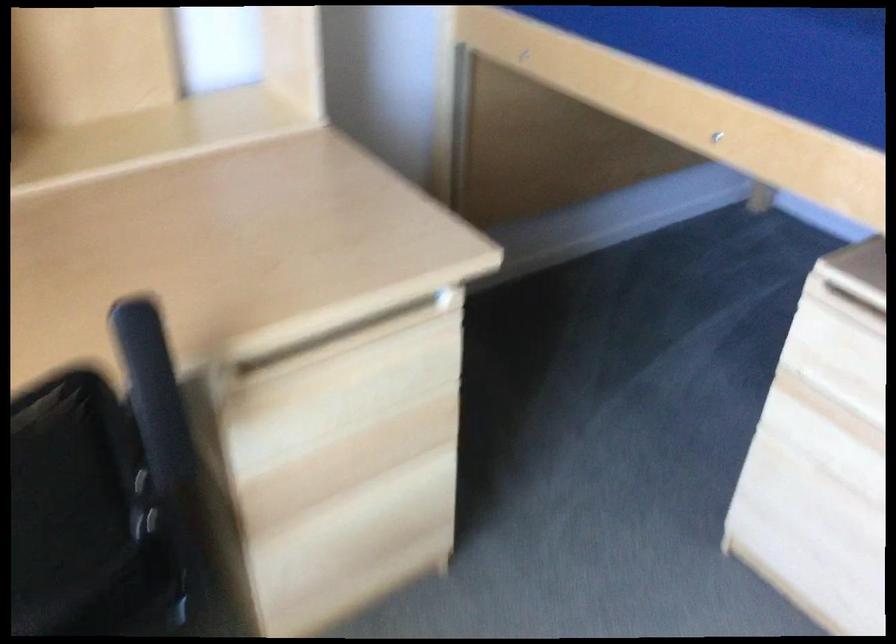
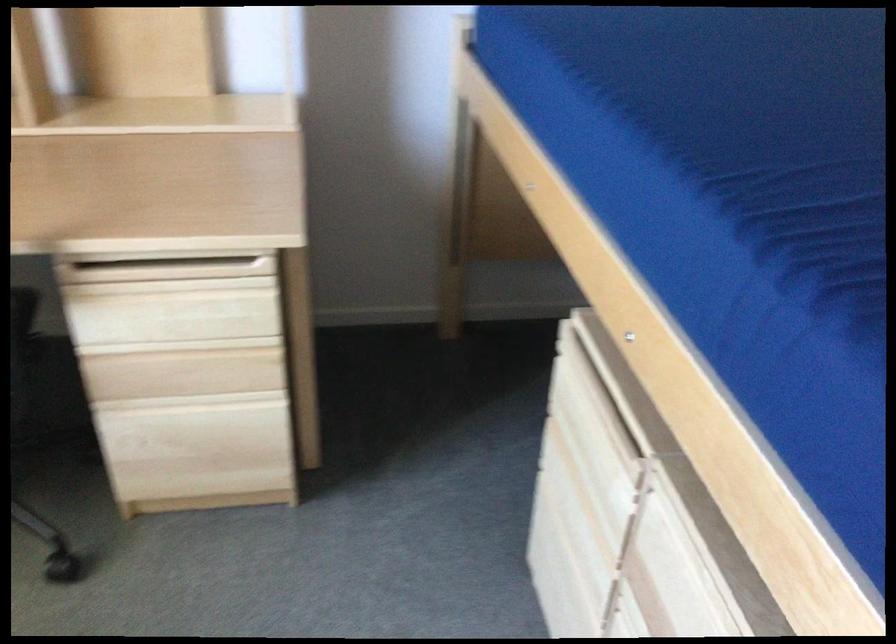
In the second image, find the point that corresponds to point (373, 488) in the first image.

(192, 401)